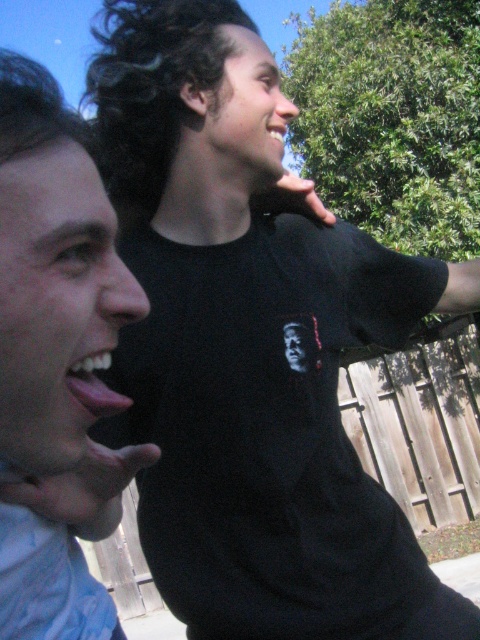
You are designing a poster and need to know the relative sizes of the blue fabric mouth at left and the black matte phone at upper center. Which one is larger?

The blue fabric mouth at left is bigger than the black matte phone at upper center according to the description.

Looking at this image, you are a photographer standing 18 inches away from the blue fabric mouth at left. Can you reach it without moving your feet?

The blue fabric mouth at left and viewer are 17.33 inches apart. Since you are standing 18 inches away, you cannot reach it without moving your feet as the distance is slightly farther than your reach.

You are taking a photo of two people in the scene. The first person is at point [20,580] and the second is at point [63,492]. Which person is closer to the camera?

Point [20,580] is closer to the camera than point [63,492].